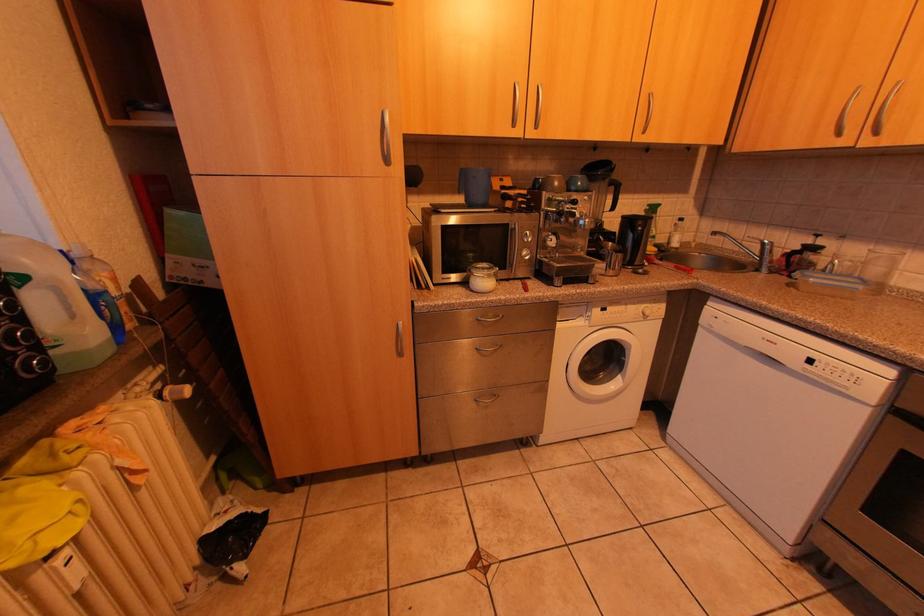
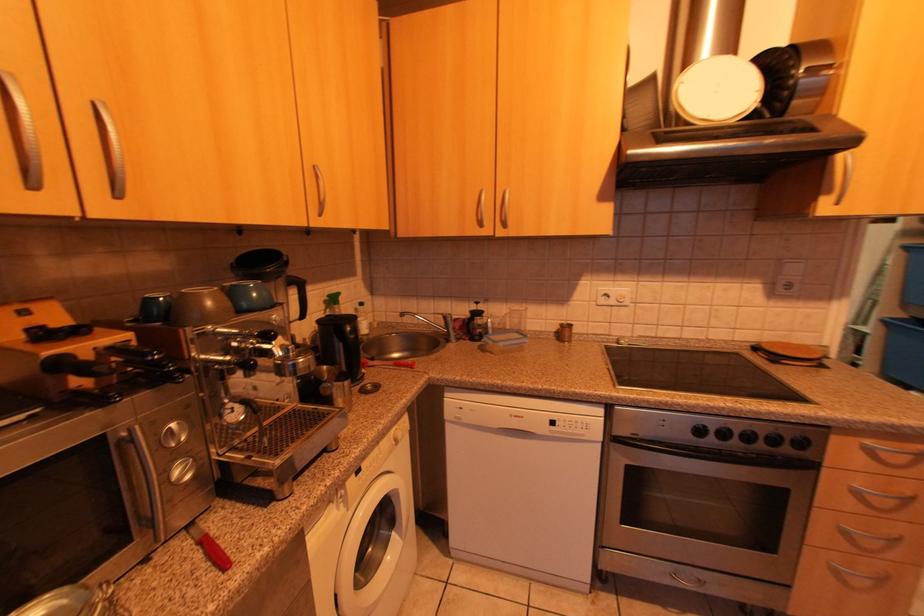
Question: Based on the continuous images, in which direction is the camera rotating? Reply with the corresponding letter.

Choices:
 (A) Left
 (B) Right
 (C) Up
 (D) Down

Answer: (B)